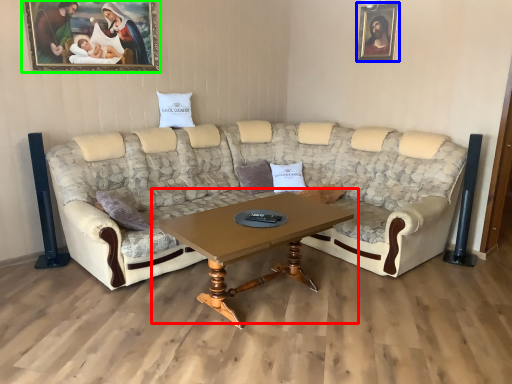
Question: Estimate the real-world distances between objects in this image. Which object is closer to coffee table (highlighted by a red box), picture frame (highlighted by a blue box) or picture frame (highlighted by a green box)?

Choices:
 (A) picture frame
 (B) picture frame

Answer: (B)